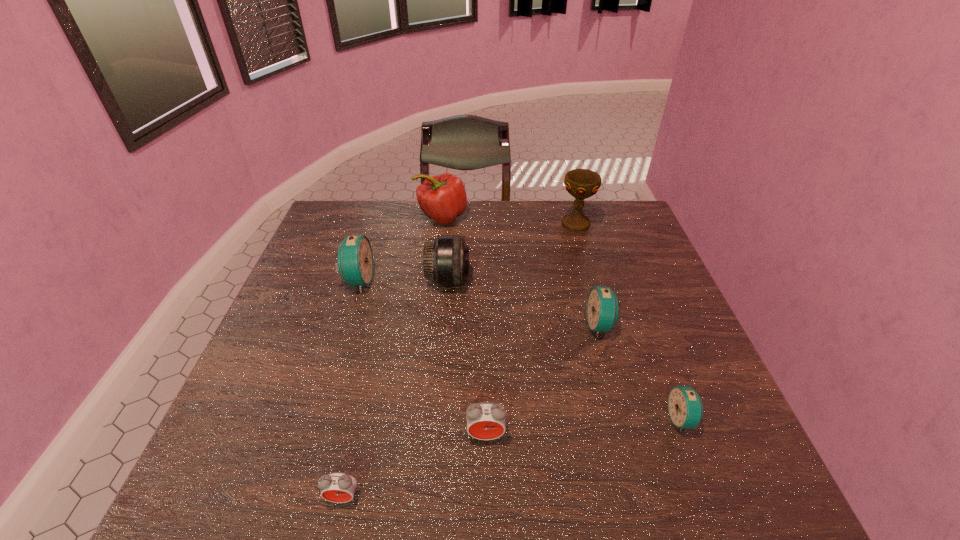
This screenshot has height=540, width=960. In order to click on unoccupied area between the bell pepper and the biggest blue alarm clock in this screenshot , I will do `click(399, 249)`.

Identify the location of vacant space that is in between the telephoto lens and the chalice. Image resolution: width=960 pixels, height=540 pixels. (512, 252).

Identify the location of free spot between the telephoto lens and the rightmost alarm clock. (564, 349).

Where is `vacant space that is in between the telephoto lens and the chalice`? vacant space that is in between the telephoto lens and the chalice is located at coordinates (512, 252).

Image resolution: width=960 pixels, height=540 pixels. Identify the location of vacant region between the smallest blue alarm clock and the telephoto lens. (564, 349).

The width and height of the screenshot is (960, 540). What are the coordinates of `object that is the fifth closest to the telephoto lens` in the screenshot? It's located at (485, 420).

Identify which object is the seventh nearest to the bell pepper. Please provide its 2D coordinates. Your answer should be formatted as a tuple, i.e. [(x, y)], where the tuple contains the x and y coordinates of a point satisfying the conditions above.

[(338, 487)]

Locate an element on the screen. alarm clock that is the fourth closest to the rightmost blue alarm clock is located at coordinates (355, 264).

Where is `alarm clock that is the third nearest to the tallest alarm clock`? The image size is (960, 540). alarm clock that is the third nearest to the tallest alarm clock is located at coordinates (603, 312).

Where is `the third closest blue alarm clock to the bell pepper`? The height and width of the screenshot is (540, 960). the third closest blue alarm clock to the bell pepper is located at coordinates (685, 407).